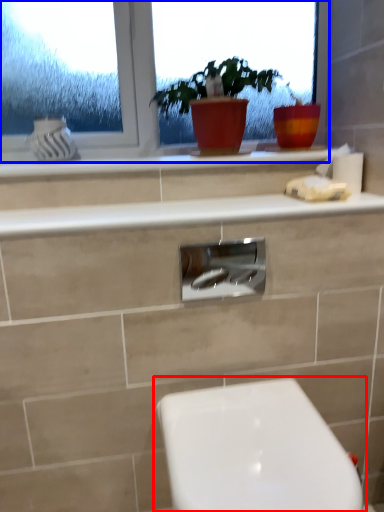
Question: Which object appears closest to the camera in this image, toilet (highlighted by a red box) or window (highlighted by a blue box)?

Choices:
 (A) toilet
 (B) window

Answer: (A)